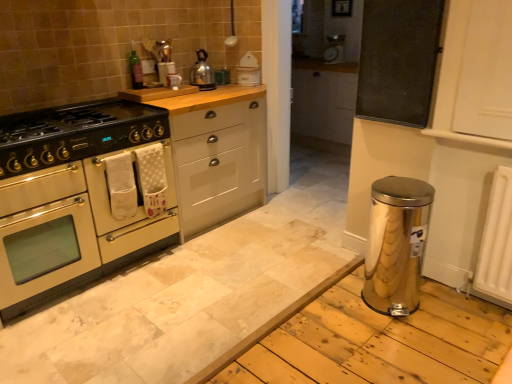
Question: Is white matte cabinet at center, which is counted as the 1th cabinetry, starting from the right, looking in the opposite direction of green glass bottle at upper center?

Choices:
 (A) yes
 (B) no

Answer: (B)

Question: Is white matte cabinet at center, the 2th cabinetry in the left-to-right sequence, surrounding green glass bottle at upper center?

Choices:
 (A) no
 (B) yes

Answer: (A)

Question: From a real-world perspective, does white matte cabinet at center, the 2th cabinetry in the left-to-right sequence, sit lower than green glass bottle at upper center?

Choices:
 (A) no
 (B) yes

Answer: (B)

Question: Is white matte cabinet at center, the 2th cabinetry in the left-to-right sequence, positioned behind green glass bottle at upper center?

Choices:
 (A) yes
 (B) no

Answer: (B)

Question: Is there a large distance between white matte cabinet at center, the 2th cabinetry in the left-to-right sequence, and green glass bottle at upper center?

Choices:
 (A) yes
 (B) no

Answer: (B)

Question: Is stainless steel water heater at lower right taller or shorter than white matte cabinet at center, which is counted as the 1th cabinetry, starting from the right?

Choices:
 (A) short
 (B) tall

Answer: (A)

Question: In the image, is stainless steel water heater at lower right positioned in front of or behind white matte cabinet at center, which is counted as the 1th cabinetry, starting from the right?

Choices:
 (A) front
 (B) behind

Answer: (A)

Question: Considering the positions of stainless steel water heater at lower right and white matte cabinet at center, which is counted as the 1th cabinetry, starting from the right, in the image, is stainless steel water heater at lower right wider or thinner than white matte cabinet at center, which is counted as the 1th cabinetry, starting from the right,?

Choices:
 (A) thin
 (B) wide

Answer: (A)

Question: Considering the relative positions of stainless steel water heater at lower right and white matte cabinet at center, which is counted as the 1th cabinetry, starting from the right, in the image provided, is stainless steel water heater at lower right to the left or to the right of white matte cabinet at center, which is counted as the 1th cabinetry, starting from the right,?

Choices:
 (A) right
 (B) left

Answer: (A)

Question: In terms of height, does matte black gas stove at left look taller or shorter compared to white plastic toaster at upper center?

Choices:
 (A) short
 (B) tall

Answer: (A)

Question: In terms of width, does matte black gas stove at left look wider or thinner when compared to white plastic toaster at upper center?

Choices:
 (A) thin
 (B) wide

Answer: (B)

Question: From a real-world perspective, relative to white plastic toaster at upper center, is matte black gas stove at left vertically above or below?

Choices:
 (A) above
 (B) below

Answer: (B)

Question: Which is correct: matte black gas stove at left is inside white plastic toaster at upper center, or outside of it?

Choices:
 (A) inside
 (B) outside

Answer: (B)

Question: Is matte black gas stove at left wider or thinner than green glass bottle at upper center?

Choices:
 (A) wide
 (B) thin

Answer: (A)

Question: In the image, is matte black gas stove at left positioned in front of or behind green glass bottle at upper center?

Choices:
 (A) front
 (B) behind

Answer: (A)